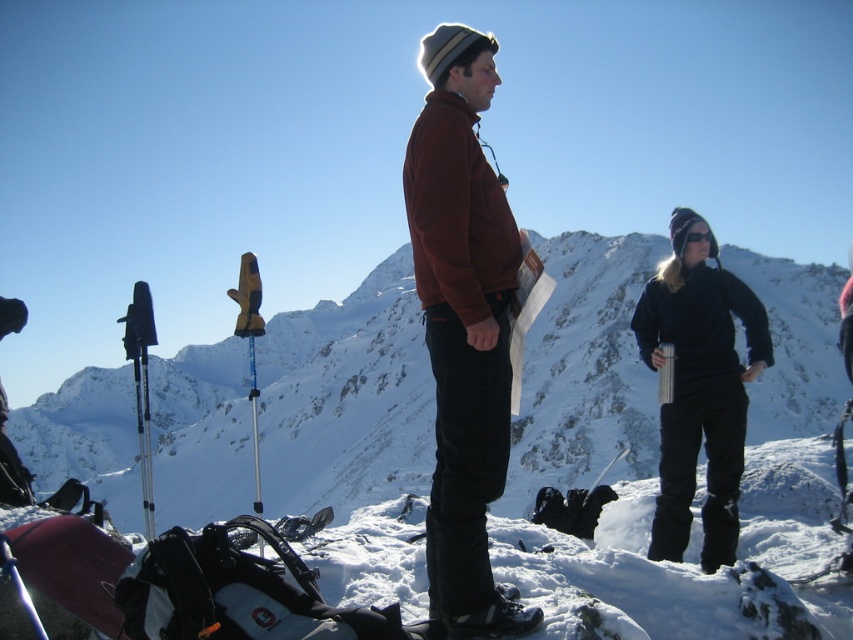
Is white snow at center in front of black matte snow pants at right?

That is False.

Does white snow at center appear under black matte snow pants at right?

No.

I want to click on white snow at center, so click(346, 397).

Looking at this image, does brown fleece jacket at center appear under black matte snow pants at right?

Yes, brown fleece jacket at center is below black matte snow pants at right.

Is brown fleece jacket at center bigger than black matte snow pants at right?

Actually, brown fleece jacket at center might be smaller than black matte snow pants at right.

Does point (477, 518) come farther from viewer compared to point (764, 365)?

No, (477, 518) is closer to viewer.

Identify the location of brown fleece jacket at center. The width and height of the screenshot is (853, 640). (463, 328).

Consider the image. Does white snow at center appear over brown fleece jacket at center?

Indeed, white snow at center is positioned over brown fleece jacket at center.

Does white snow at center appear under brown fleece jacket at center?

No.

Between point (585, 292) and point (459, 150), which one is positioned in front?

Point (459, 150) is in front.

This screenshot has width=853, height=640. I want to click on white snow at center, so click(346, 397).